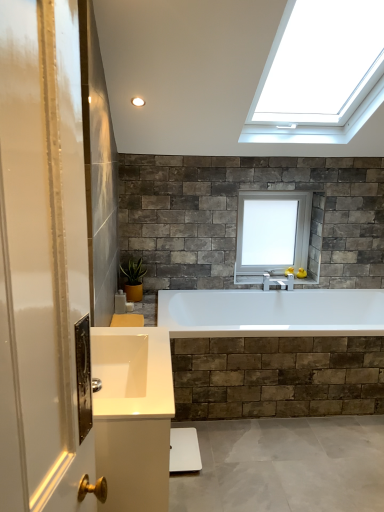
Question: Could you tell me if white glossy sink at lower left is facing green matte plant at lower left?

Choices:
 (A) no
 (B) yes

Answer: (A)

Question: Can you confirm if white glossy sink at lower left is taller than green matte plant at lower left?

Choices:
 (A) no
 (B) yes

Answer: (A)

Question: Is white glossy sink at lower left at the right side of green matte plant at lower left?

Choices:
 (A) yes
 (B) no

Answer: (A)

Question: Would you say white glossy sink at lower left is a long distance from green matte plant at lower left?

Choices:
 (A) no
 (B) yes

Answer: (B)

Question: Is white glossy sink at lower left behind green matte plant at lower left?

Choices:
 (A) no
 (B) yes

Answer: (A)

Question: Does white glossy sink at lower left have a greater width compared to green matte plant at lower left?

Choices:
 (A) yes
 (B) no

Answer: (A)

Question: Is white glass window at upper center facing away from white glossy sink at lower left?

Choices:
 (A) no
 (B) yes

Answer: (A)

Question: Can you confirm if white glass window at upper center is smaller than white glossy sink at lower left?

Choices:
 (A) yes
 (B) no

Answer: (B)

Question: Can we say white glass window at upper center lies outside white glossy sink at lower left?

Choices:
 (A) yes
 (B) no

Answer: (A)

Question: Is white glass window at upper center at the right side of white glossy sink at lower left?

Choices:
 (A) yes
 (B) no

Answer: (A)

Question: Considering the relative sizes of white glass window at upper center and white glossy sink at lower left in the image provided, is white glass window at upper center shorter than white glossy sink at lower left?

Choices:
 (A) yes
 (B) no

Answer: (B)

Question: From a real-world perspective, is white glass window at upper center positioned under white glossy sink at lower left based on gravity?

Choices:
 (A) no
 (B) yes

Answer: (A)

Question: Is white glossy sink at lower left a part of green matte plant at lower left?

Choices:
 (A) yes
 (B) no

Answer: (B)